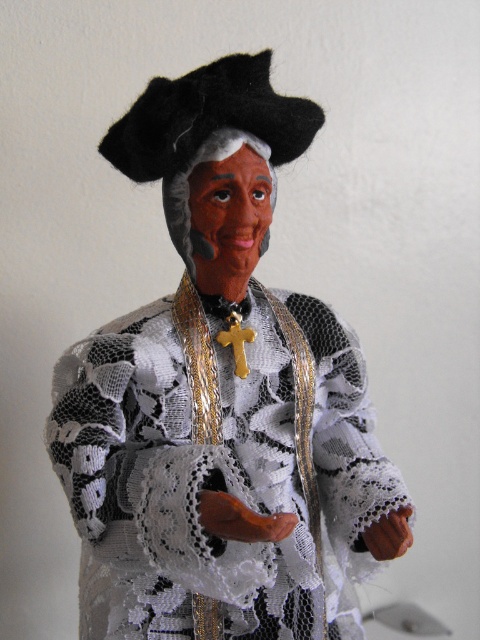
Question: Which point appears farthest from the camera in this image?

Choices:
 (A) (242, 273)
 (B) (194, 228)

Answer: (A)

Question: Which object is farther from the camera taking this photo?

Choices:
 (A) matte black face at center
 (B) white lace dress at center

Answer: (A)

Question: Which point is closer to the camera?

Choices:
 (A) (201, 259)
 (B) (172, 317)

Answer: (A)

Question: Considering the relative positions of white lace dress at center and matte black face at center in the image provided, where is white lace dress at center located with respect to matte black face at center?

Choices:
 (A) above
 (B) below

Answer: (B)

Question: Is white lace dress at center wider than matte black face at center?

Choices:
 (A) yes
 (B) no

Answer: (A)

Question: Can you confirm if white lace dress at center is bigger than matte black face at center?

Choices:
 (A) yes
 (B) no

Answer: (A)